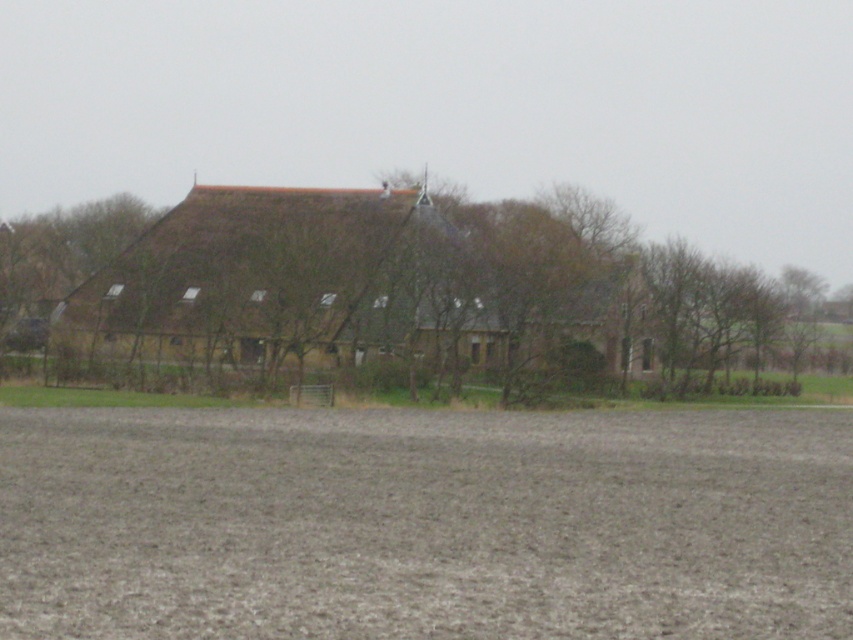
Image resolution: width=853 pixels, height=640 pixels. Describe the element at coordinates (424, 524) in the screenshot. I see `brown soil at lower center` at that location.

Does point (648, 563) lie behind point (207, 262)?

No.

Locate an element on the screen. The height and width of the screenshot is (640, 853). brown soil at lower center is located at coordinates (424, 524).